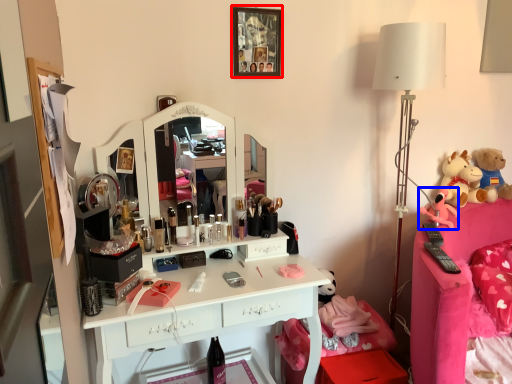
Question: Which object appears closest to the camera in this image, picture frame (highlighted by a red box) or toy (highlighted by a blue box)?

Choices:
 (A) picture frame
 (B) toy

Answer: (A)